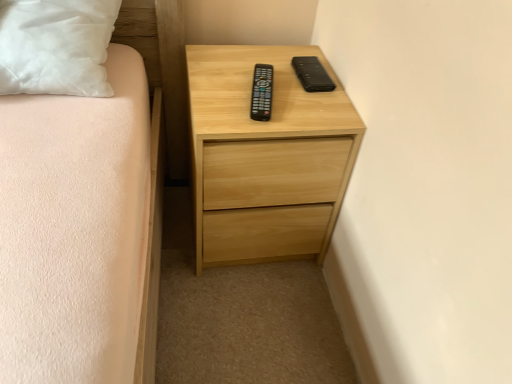
This screenshot has width=512, height=384. I want to click on free space to the back side of black plastic remote at center, so click(x=252, y=68).